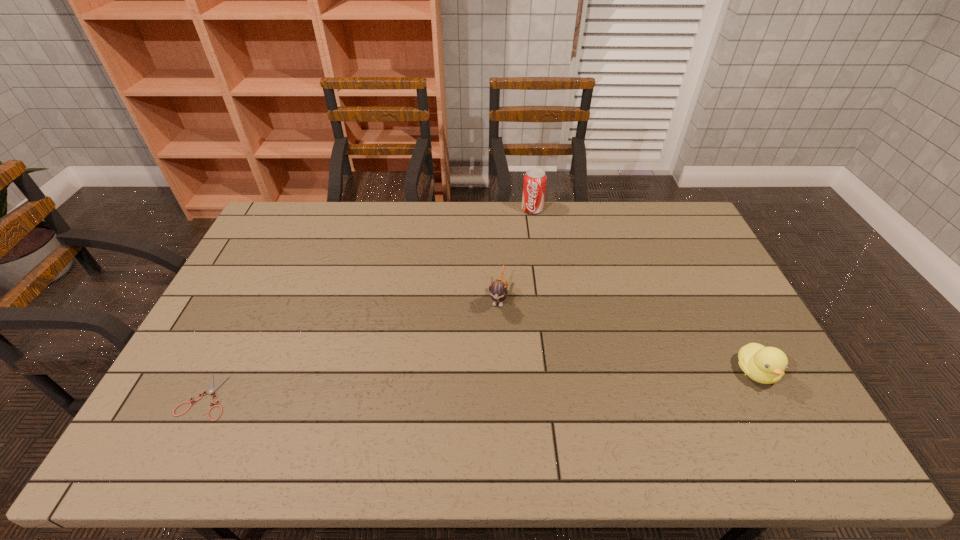
Find the location of `the leftmost object`. the leftmost object is located at coordinates (211, 389).

The width and height of the screenshot is (960, 540). I want to click on the shortest object, so click(x=211, y=389).

Find the location of a particular element. duckling is located at coordinates (766, 365).

Where is `kitten`? This screenshot has height=540, width=960. kitten is located at coordinates (498, 289).

Find the location of a particular element. This screenshot has height=540, width=960. the second object from left to right is located at coordinates (498, 289).

You are a GUI agent. You are given a task and a screenshot of the screen. Output one action in this format:
    pyautogui.click(x=<x>, y=<y>)
    Task: Click on the tallest object
    This screenshot has height=540, width=960.
    Given the screenshot: What is the action you would take?
    pyautogui.click(x=534, y=184)

Locate an element on the screen. This screenshot has height=540, width=960. the second object from right to left is located at coordinates (534, 184).

You are a GUI agent. You are given a task and a screenshot of the screen. Output one action in this format:
    pyautogui.click(x=<x>, y=<y>)
    Task: Click on the vacant space positioned on the back of the leftmost object
    The height and width of the screenshot is (540, 960).
    Given the screenshot: What is the action you would take?
    coord(246,318)

At what (x,y) coordinates should I click in order to perform the action: click on free space located 0.050m at the beak of the rightmost object. Please return your answer as a coordinate pair (x, y). The height and width of the screenshot is (540, 960). Looking at the image, I should click on (776, 410).

Identify the location of vacant region located 0.160m on the front-facing side of the second farthest object. Image resolution: width=960 pixels, height=540 pixels. (489, 360).